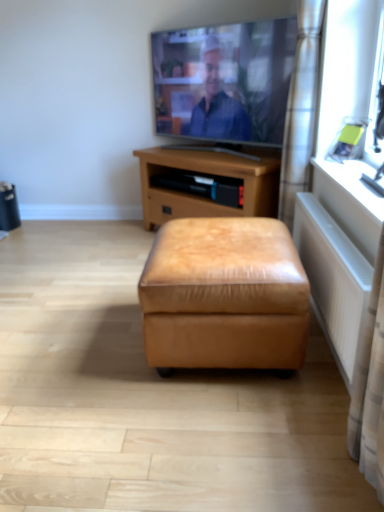
This screenshot has width=384, height=512. In order to click on vacant area that is in front of tan leather ottoman at center in this screenshot , I will do `click(205, 436)`.